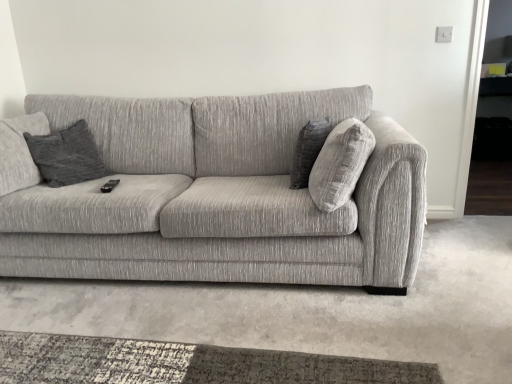
Question: Would you say textured gray couch at center is inside or outside dark gray textured pillow at center?

Choices:
 (A) outside
 (B) inside

Answer: (A)

Question: Considering the relative positions of textured gray couch at center and dark gray textured pillow at center in the image provided, is textured gray couch at center to the left or to the right of dark gray textured pillow at center?

Choices:
 (A) right
 (B) left

Answer: (B)

Question: From a real-world perspective, is textured gray couch at center physically located above or below dark gray textured pillow at center?

Choices:
 (A) below
 (B) above

Answer: (A)

Question: From the image's perspective, relative to textured gray couch at center, is dark gray textured pillow at center above or below?

Choices:
 (A) above
 (B) below

Answer: (A)

Question: Which is correct: dark gray textured pillow at center is inside textured gray couch at center, or outside of it?

Choices:
 (A) inside
 (B) outside

Answer: (A)

Question: Is dark gray textured pillow at center taller or shorter than textured gray couch at center?

Choices:
 (A) short
 (B) tall

Answer: (A)

Question: Is dark gray textured pillow at center bigger or smaller than textured gray couch at center?

Choices:
 (A) small
 (B) big

Answer: (A)